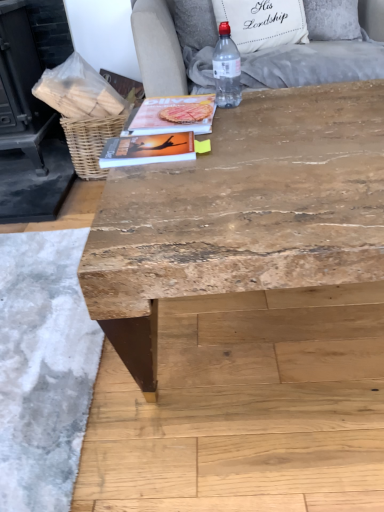
Find the location of a particular element. vacant space in front of matte paper magazine at center, the second magazine from the front is located at coordinates (214, 153).